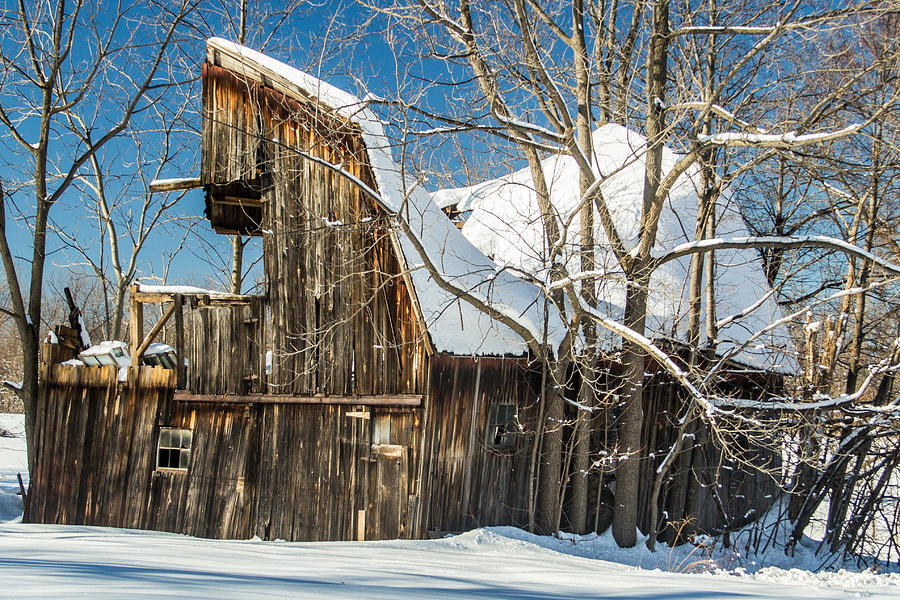
In order to click on window in this screenshot , I will do `click(174, 441)`.